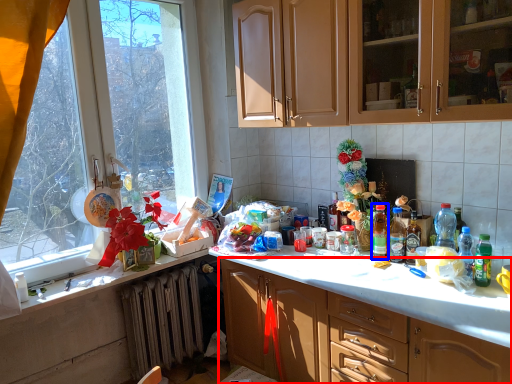
Question: Which object is closer to the camera taking this photo, cabinetry (highlighted by a red box) or bottle (highlighted by a blue box)?

Choices:
 (A) cabinetry
 (B) bottle

Answer: (A)